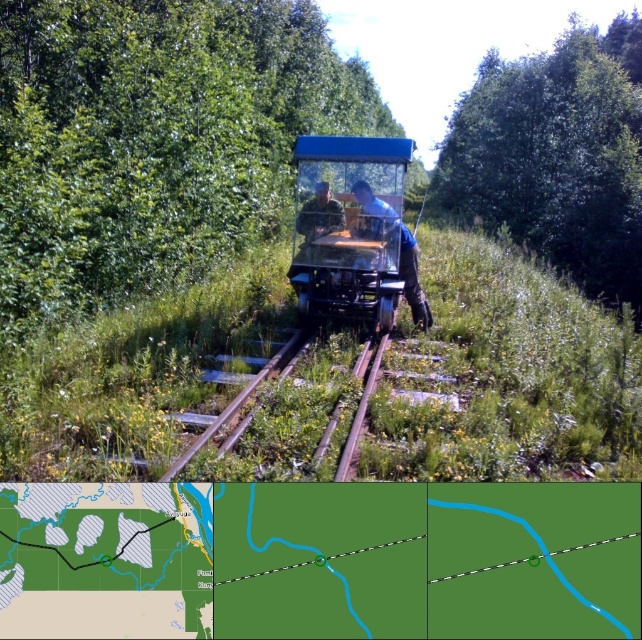
Question: Where is green leafy tree at center located in relation to blue transparent vehicle at center in the image?

Choices:
 (A) left
 (B) right

Answer: (A)

Question: Which point is closer to the camera taking this photo?

Choices:
 (A) pos(374,273)
 (B) pos(575,214)
 (C) pos(300,208)
 (D) pos(65,198)

Answer: (D)

Question: Estimate the real-world distances between objects in this image. Which object is farther from the green leafy tree at upper center?

Choices:
 (A) green leafy tree at center
 (B) transparent plastic train at center
 (C) metal/smooth train track at center

Answer: (C)

Question: Considering the relative positions of blue transparent vehicle at center and camouflage fabric man at center in the image provided, where is blue transparent vehicle at center located with respect to camouflage fabric man at center?

Choices:
 (A) right
 (B) left

Answer: (A)

Question: Is green leafy tree at upper center thinner than metal/smooth train track at center?

Choices:
 (A) yes
 (B) no

Answer: (B)

Question: Which point is closer to the camera?

Choices:
 (A) (403, 259)
 (B) (537, 236)
 (C) (299, 333)
 (D) (56, 122)

Answer: (C)